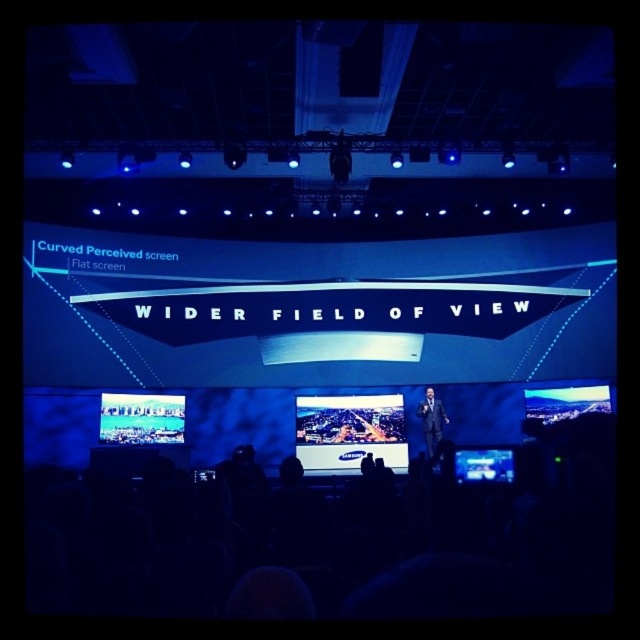
Question: Among these objects, which one is nearest to the camera?

Choices:
 (A) matte black screen at lower right
 (B) matte black screen at center
 (C) matte black screen at lower left

Answer: (A)

Question: Considering the relative positions of matte black screen at lower left and matte black screen at lower right in the image provided, where is matte black screen at lower left located with respect to matte black screen at lower right?

Choices:
 (A) below
 (B) above

Answer: (B)

Question: Is matte black screen at center to the left of dark suit at center from the viewer's perspective?

Choices:
 (A) yes
 (B) no

Answer: (A)

Question: Considering the relative positions of matte black screen at center and dark suit at center in the image provided, where is matte black screen at center located with respect to dark suit at center?

Choices:
 (A) below
 (B) above

Answer: (A)

Question: Among these objects, which one is nearest to the camera?

Choices:
 (A) matte black screen at lower left
 (B) matte black screen at lower right

Answer: (B)

Question: Which object appears farthest from the camera in this image?

Choices:
 (A) dark suit at center
 (B) matte black screen at center

Answer: (B)